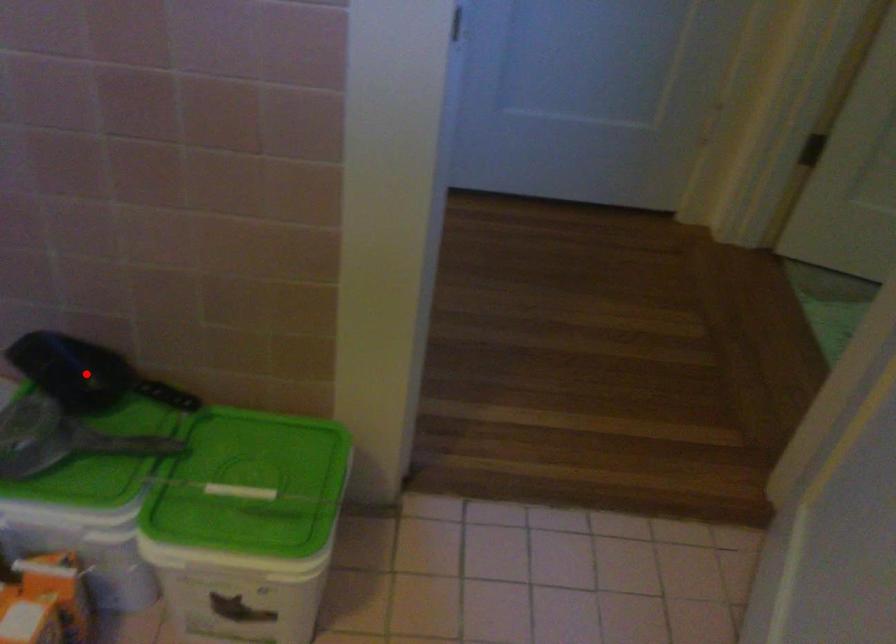
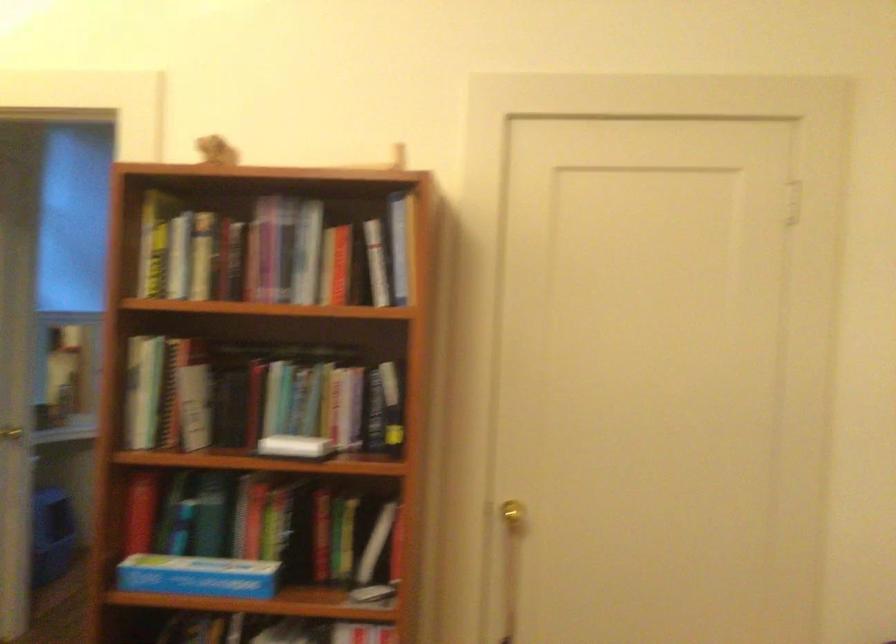
Question: I am providing you with two images of the same scene from different viewpoints. A red point is marked on the first image. Can you still see the location of the red point in image 2?

Choices:
 (A) Yes
 (B) No

Answer: (B)